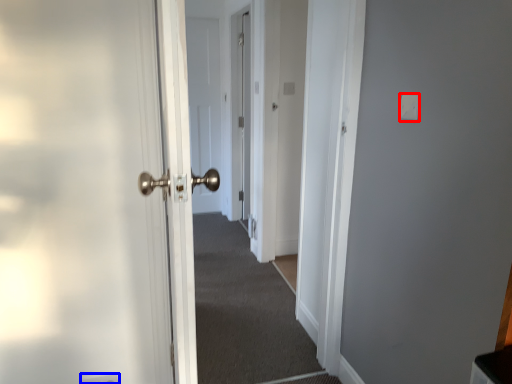
Question: Which point is further to the camera, light switch (highlighted by a red box) or electric outlet (highlighted by a blue box)?

Choices:
 (A) light switch
 (B) electric outlet

Answer: (B)